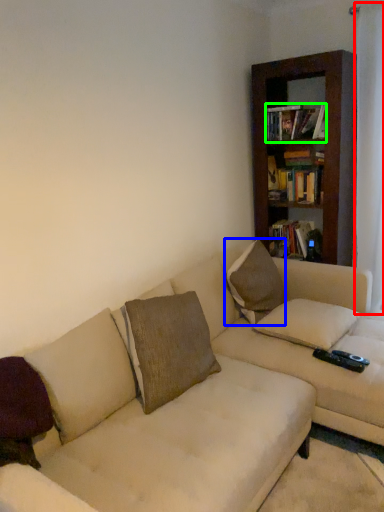
Question: Based on their relative distances, which object is farther from curtain (highlighted by a red box)? Choose from pillow (highlighted by a blue box) and book (highlighted by a green box).

Choices:
 (A) pillow
 (B) book

Answer: (A)